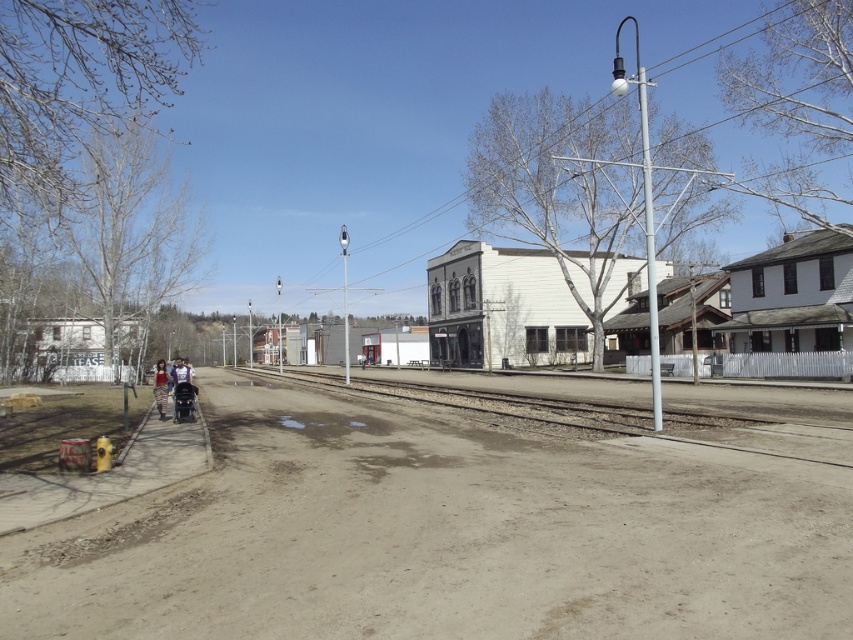
Question: Which point appears farthest from the camera in this image?

Choices:
 (A) (27, 612)
 (B) (666, 403)

Answer: (B)

Question: Which of the following is the closest to the observer?

Choices:
 (A) brown gravel train track at center
 (B) brown sandy dirt track at lower center

Answer: (B)

Question: Can you confirm if brown sandy dirt track at lower center is smaller than brown gravel train track at center?

Choices:
 (A) no
 (B) yes

Answer: (B)

Question: Which of the following is the farthest from the observer?

Choices:
 (A) brown sandy dirt track at lower center
 (B) brown gravel train track at center

Answer: (B)

Question: Is brown sandy dirt track at lower center wider than brown gravel train track at center?

Choices:
 (A) yes
 (B) no

Answer: (B)

Question: Is brown sandy dirt track at lower center closer to camera compared to brown gravel train track at center?

Choices:
 (A) no
 (B) yes

Answer: (B)